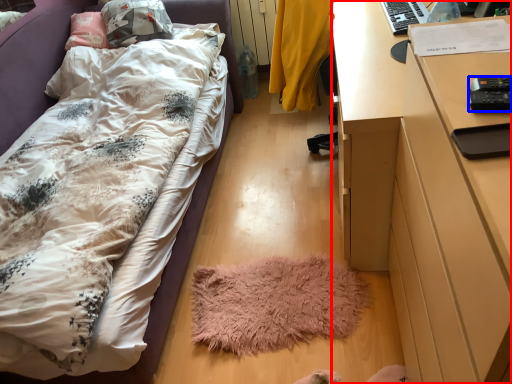
Question: Which of the following is the farthest to the observer, desk (highlighted by a red box) or remote control (highlighted by a blue box)?

Choices:
 (A) desk
 (B) remote control

Answer: (B)